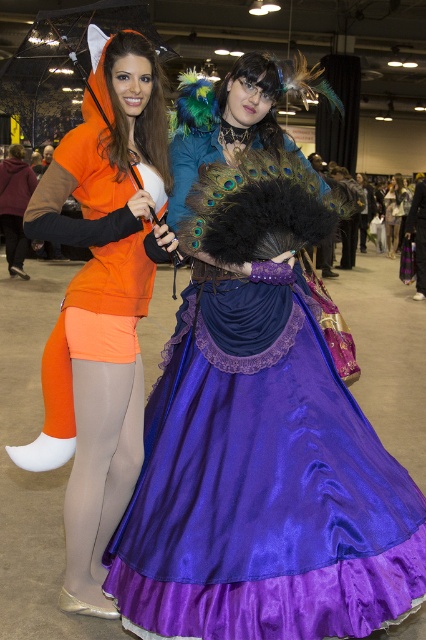
Measure the distance from satin purple dress at center to transparent plastic umbrella at upper center.

The distance of satin purple dress at center from transparent plastic umbrella at upper center is 1.03 meters.

Does satin purple dress at center have a greater height compared to transparent plastic umbrella at upper center?

Correct, satin purple dress at center is much taller as transparent plastic umbrella at upper center.

From the picture: Measure the distance between satin purple dress at center and camera.

satin purple dress at center and camera are 6.01 feet apart.

I want to click on satin purple dress at center, so click(x=259, y=426).

Based on the photo, who is more distant from viewer, (239, 356) or (101, 534)?

Answer: The point (101, 534) is behind.

Does satin purple dress at center appear on the left side of matte orange hoodie at left?

No, satin purple dress at center is not to the left of matte orange hoodie at left.

Where is `satin purple dress at center`? The width and height of the screenshot is (426, 640). satin purple dress at center is located at coordinates (259, 426).

Who is positioned more to the right, satin purple dress at center or purple satin dress at center?

purple satin dress at center is more to the right.

Who is more distant from viewer, (420, 564) or (397, 204)?

The point (397, 204) is more distant.

Who is more forward, (304, 388) or (394, 230)?

Point (304, 388)

Find the location of a particular element. This screenshot has height=640, width=426. satin purple dress at center is located at coordinates (259, 426).